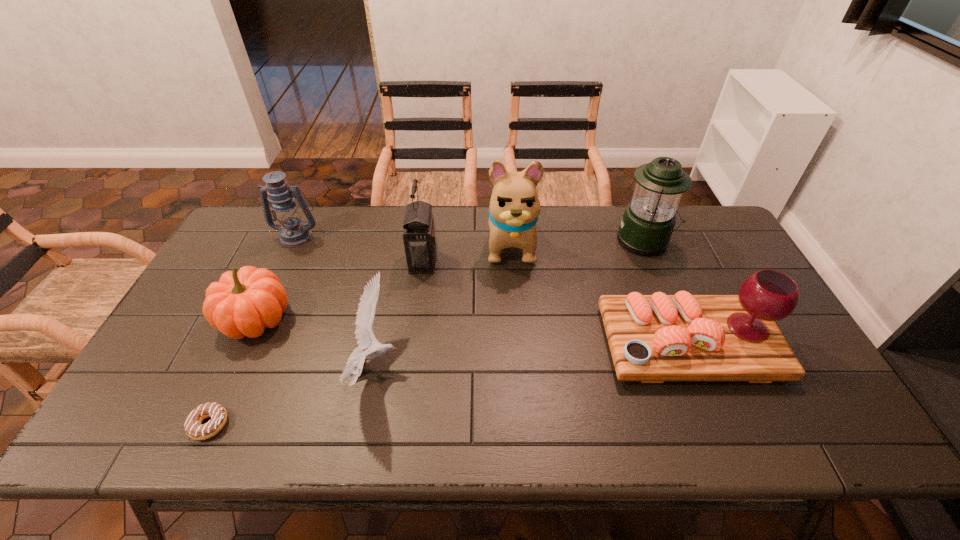
Image resolution: width=960 pixels, height=540 pixels. Find the location of `vacant region located 0.340m on the front-facing side of the second lantern from right to left`. vacant region located 0.340m on the front-facing side of the second lantern from right to left is located at coordinates (546, 261).

The width and height of the screenshot is (960, 540). What are the coordinates of `vacant region located 0.290m on the front-facing side of the leftmost lantern` in the screenshot? It's located at (260, 316).

Find the location of `free space located 0.310m on the back of the platter`. free space located 0.310m on the back of the platter is located at coordinates (645, 237).

At what (x,y) coordinates should I click in order to perform the action: click on free spot located 0.280m on the right of the pumpkin. Please return your answer as a coordinate pair (x, y). The height and width of the screenshot is (540, 960). Looking at the image, I should click on (393, 319).

Locate an element on the screen. The width and height of the screenshot is (960, 540). free space located 0.300m at the tip of the beak of the gull is located at coordinates [x=521, y=366].

Locate an element on the screen. This screenshot has width=960, height=540. free region located 0.120m on the left of the doughnut is located at coordinates (137, 424).

Locate an element on the screen. The width and height of the screenshot is (960, 540). puppy that is positioned at the far edge is located at coordinates (514, 208).

The width and height of the screenshot is (960, 540). Identify the location of gull at the near edge. (365, 337).

In order to click on doughnut that is at the near edge in this screenshot , I will do `click(192, 425)`.

You are a GUI agent. You are given a task and a screenshot of the screen. Output one action in this format:
    pyautogui.click(x=<x>, y=<y>)
    Task: Click on the lantern present at the left edge
    The height and width of the screenshot is (540, 960).
    Given the screenshot: What is the action you would take?
    pyautogui.click(x=293, y=232)